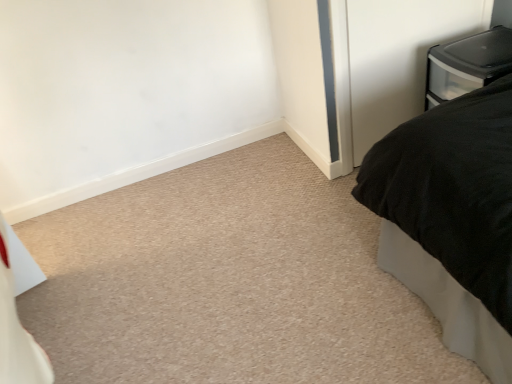
What do you see at coordinates (451, 218) in the screenshot? This screenshot has height=384, width=512. I see `black matte bed at right` at bounding box center [451, 218].

I want to click on clear plastic drawer at upper right, so click(398, 58).

The width and height of the screenshot is (512, 384). Identify the location of clear plastic storage container at upper right. (467, 64).

Does clear plastic storage container at upper right appear on the right side of black matte bed at right?

Indeed, clear plastic storage container at upper right is positioned on the right side of black matte bed at right.

Does clear plastic storage container at upper right have a larger size compared to black matte bed at right?

No, clear plastic storage container at upper right is not bigger than black matte bed at right.

Is clear plastic storage container at upper right located outside black matte bed at right?

Yes.

From the picture: Which of these two, clear plastic drawer at upper right or clear plastic storage container at upper right, is thinner?

With smaller width is clear plastic drawer at upper right.

How distant is clear plastic drawer at upper right from clear plastic storage container at upper right?

clear plastic drawer at upper right is 9.53 inches from clear plastic storage container at upper right.

Is clear plastic drawer at upper right positioned with its back to clear plastic storage container at upper right?

Absolutely, clear plastic drawer at upper right is directed away from clear plastic storage container at upper right.

Does point (356, 98) come closer to viewer compared to point (488, 164)?

No, it is not.

From the image's perspective, which one is positioned lower, clear plastic drawer at upper right or black matte bed at right?

black matte bed at right.

Would you say clear plastic drawer at upper right is inside or outside black matte bed at right?

clear plastic drawer at upper right exists outside the volume of black matte bed at right.

Between clear plastic storage container at upper right and clear plastic drawer at upper right, which one has larger size?

clear plastic storage container at upper right.

Is clear plastic storage container at upper right not close to clear plastic drawer at upper right?

No, clear plastic storage container at upper right is not far away from clear plastic drawer at upper right.

Which object is closer to the camera taking this photo, clear plastic storage container at upper right or clear plastic drawer at upper right?

clear plastic storage container at upper right is closer to the camera.

Considering the sizes of clear plastic storage container at upper right and clear plastic drawer at upper right in the image, is clear plastic storage container at upper right taller or shorter than clear plastic drawer at upper right?

In the image, clear plastic storage container at upper right appears to be shorter than clear plastic drawer at upper right.

From a real-world perspective, is black matte bed at right positioned over clear plastic drawer at upper right based on gravity?

No, from a real-world perspective, black matte bed at right is not above clear plastic drawer at upper right.

Between black matte bed at right and clear plastic drawer at upper right, which one appears on the left side from the viewer's perspective?

clear plastic drawer at upper right.

Is black matte bed at right shorter than clear plastic drawer at upper right?

Correct, black matte bed at right is not as tall as clear plastic drawer at upper right.

Is black matte bed at right positioned with its back to clear plastic drawer at upper right?

black matte bed at right does not have its back to clear plastic drawer at upper right.

How many degrees apart are the facing directions of black matte bed at right and clear plastic storage container at upper right?

They differ by 87.1 degrees in their facing directions.

Does black matte bed at right have a greater height compared to clear plastic storage container at upper right?

Yes, black matte bed at right is taller than clear plastic storage container at upper right.

Is black matte bed at right completely or partially outside of clear plastic storage container at upper right?

Yes, black matte bed at right is located beyond the bounds of clear plastic storage container at upper right.

Is black matte bed at right thinner than clear plastic storage container at upper right?

No, black matte bed at right is not thinner than clear plastic storage container at upper right.

Image resolution: width=512 pixels, height=384 pixels. Identify the location of furniture that is above the black matte bed at right (from the image's perspective). (467, 64).

This screenshot has height=384, width=512. What are the coordinates of `screen door behind the clear plastic storage container at upper right` in the screenshot? It's located at (398, 58).

When comparing their distances from clear plastic drawer at upper right, does clear plastic storage container at upper right or black matte bed at right seem further?

Based on the image, black matte bed at right appears to be further to clear plastic drawer at upper right.

Estimate the real-world distances between objects in this image. Which object is closer to black matte bed at right, clear plastic storage container at upper right or clear plastic drawer at upper right?

Based on the image, clear plastic storage container at upper right appears to be nearer to black matte bed at right.

In the scene shown: From the image, which object appears to be farther from clear plastic storage container at upper right, black matte bed at right or clear plastic drawer at upper right?

Based on the image, black matte bed at right appears to be further to clear plastic storage container at upper right.

Considering their positions, is clear plastic drawer at upper right positioned closer to black matte bed at right than clear plastic storage container at upper right?

clear plastic storage container at upper right is positioned closer to the anchor black matte bed at right.

Looking at this image, from the image, which object appears to be nearer to clear plastic drawer at upper right, black matte bed at right or clear plastic storage container at upper right?

clear plastic storage container at upper right.

From the image, which object appears to be farther from clear plastic storage container at upper right, clear plastic drawer at upper right or black matte bed at right?

black matte bed at right.

You are a GUI agent. You are given a task and a screenshot of the screen. Output one action in this format:
    pyautogui.click(x=<x>, y=<y>)
    Task: Click on the furniture between black matte bed at right and clear plastic drawer at upper right in the front-back direction
    The image size is (512, 384).
    Given the screenshot: What is the action you would take?
    pyautogui.click(x=467, y=64)